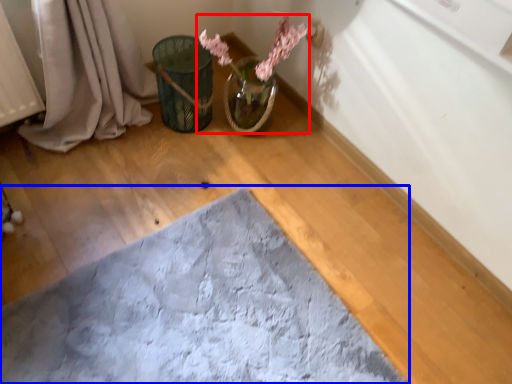
Question: Which object appears closest to the camera in this image, floral arrangement (highlighted by a red box) or bath mat (highlighted by a blue box)?

Choices:
 (A) floral arrangement
 (B) bath mat

Answer: (B)